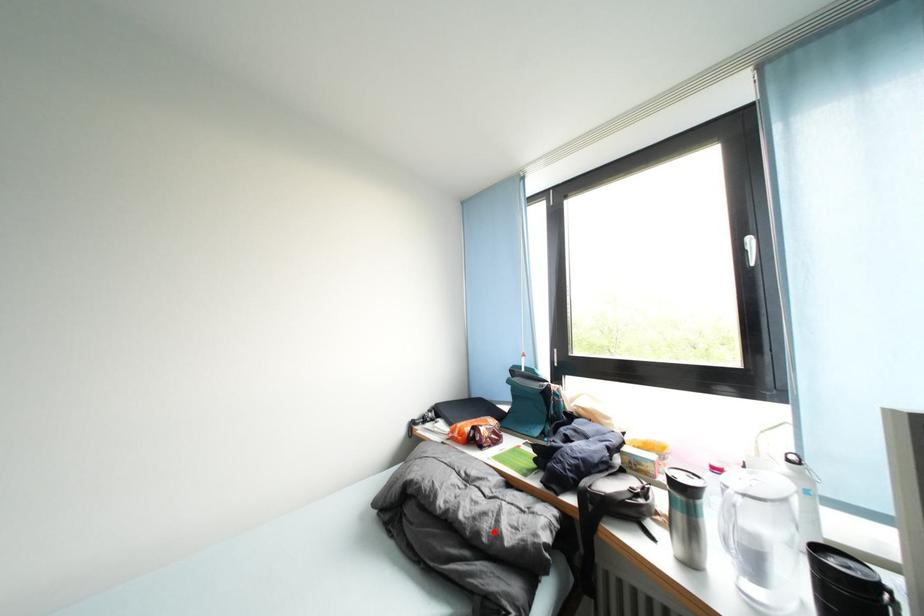
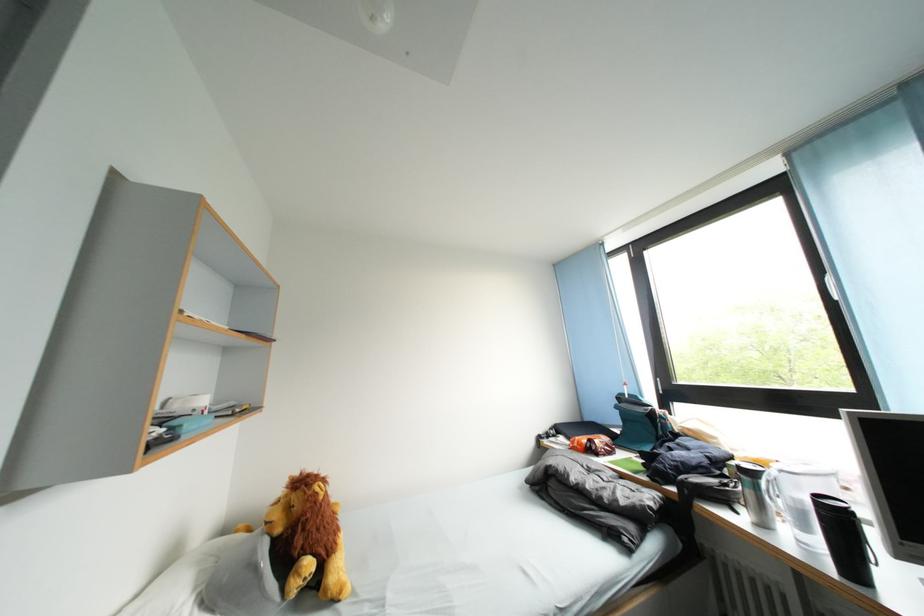
In the second image, find the point that corresponds to the highlighted location in the first image.

(614, 501)